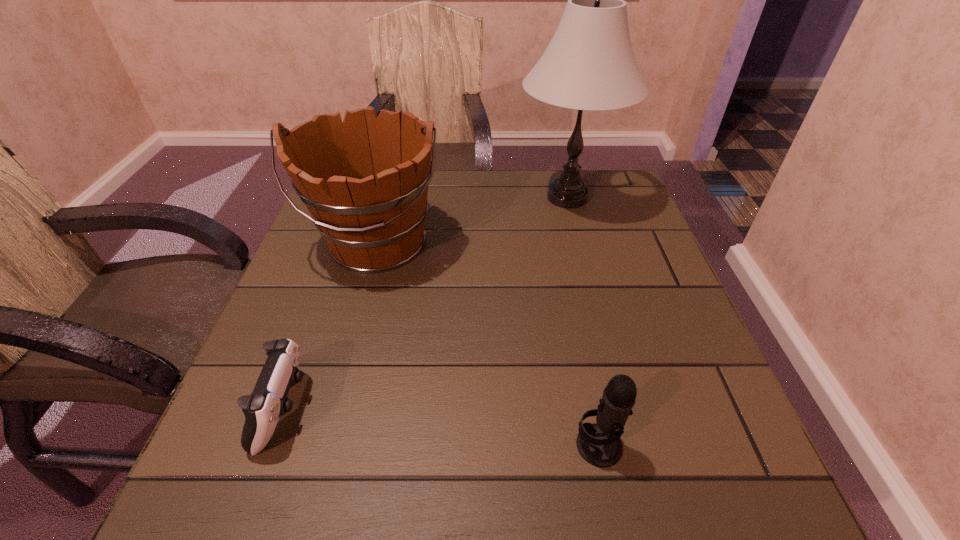
The height and width of the screenshot is (540, 960). I want to click on the tallest object, so click(x=589, y=64).

Locate an element on the screen. The height and width of the screenshot is (540, 960). the second tallest object is located at coordinates (365, 181).

Identify the location of the second shortest object. The image size is (960, 540). (599, 444).

In order to click on the shortest object in this screenshot , I will do (x=268, y=401).

This screenshot has width=960, height=540. I want to click on vacant area situated on the front of the tallest object, so click(x=595, y=303).

Where is `vacant position located with the handle on the wine bucket`? vacant position located with the handle on the wine bucket is located at coordinates (349, 341).

Identify the location of free space located on the left of the microphone. This screenshot has height=540, width=960. (422, 446).

This screenshot has width=960, height=540. Identify the location of free point located 0.320m on the front-facing side of the shortest object. (503, 409).

Where is `lamp at the far edge`? The image size is (960, 540). lamp at the far edge is located at coordinates (589, 64).

Identify the location of wine bucket that is at the far edge. The width and height of the screenshot is (960, 540). (365, 181).